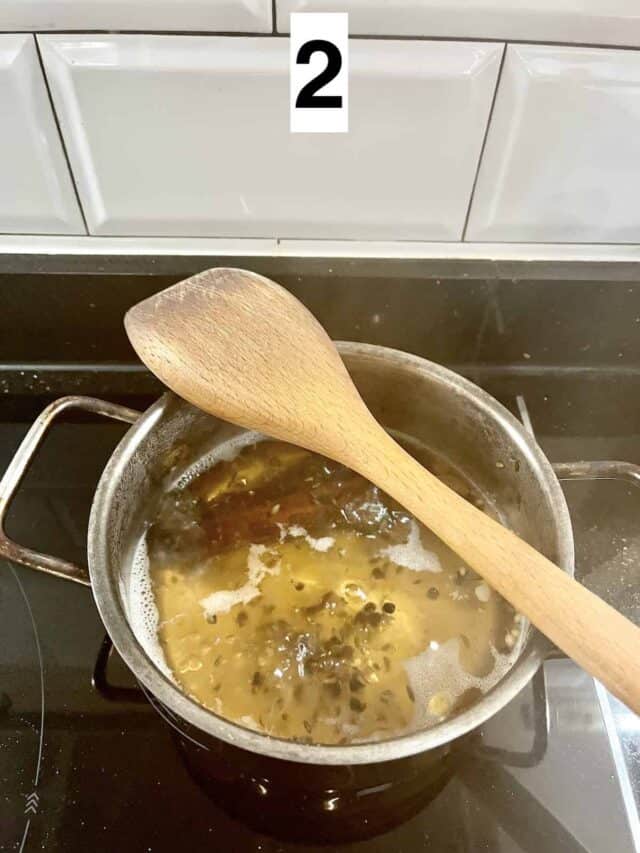
Find the location of a particular element. background, white subway title is located at coordinates (368, 155).